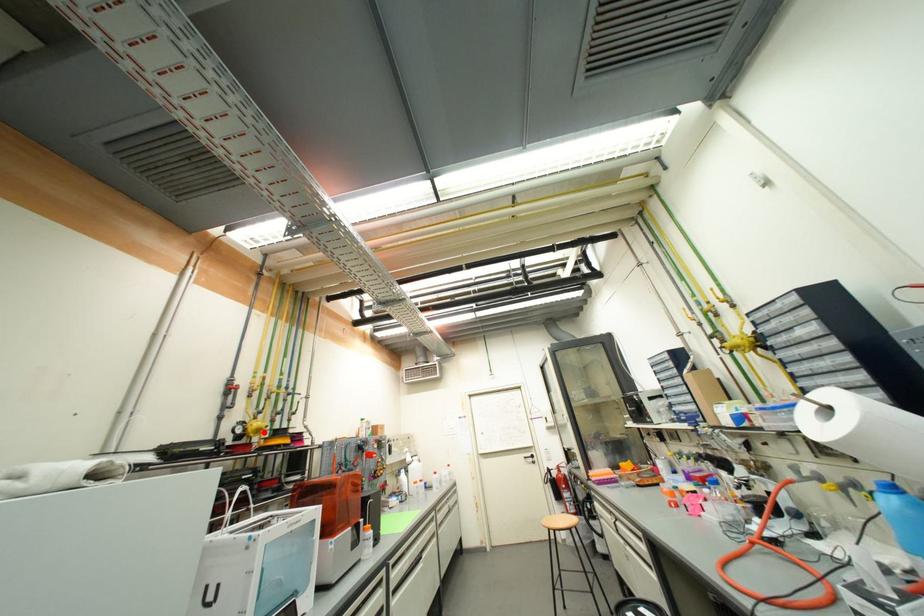
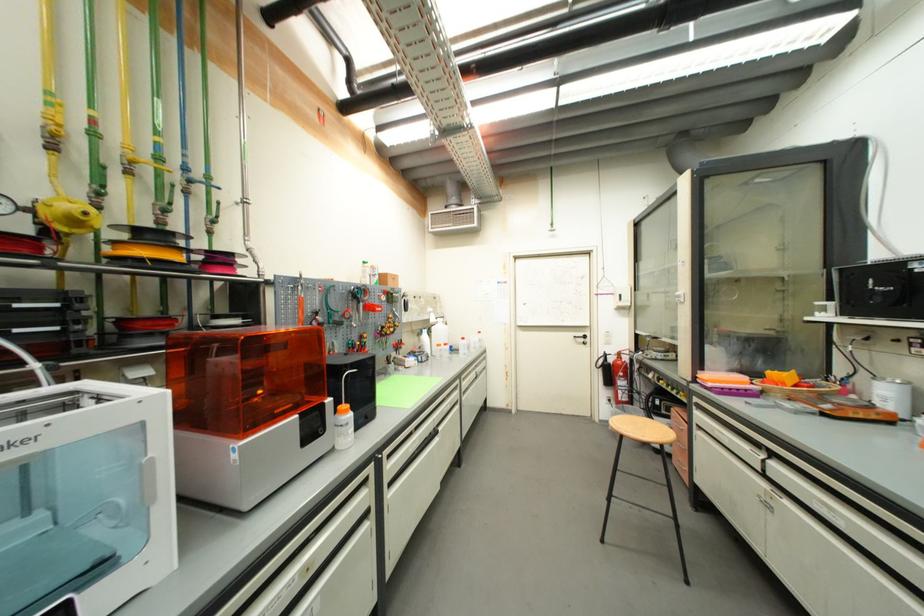
Locate, in the second image, the point that corresponds to the highlighted location in the first image.

(82, 224)